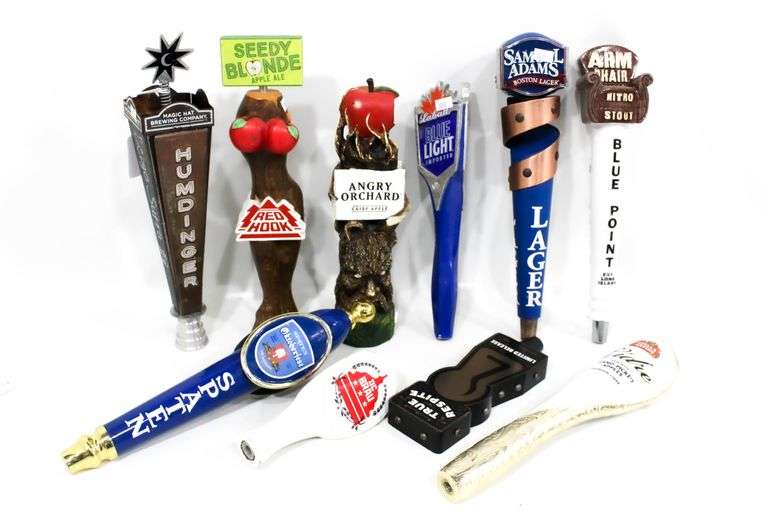
Identify the location of beer tap. (607, 131), (545, 112), (442, 144), (372, 179), (263, 206), (167, 168), (250, 366), (362, 414), (452, 393), (616, 368).